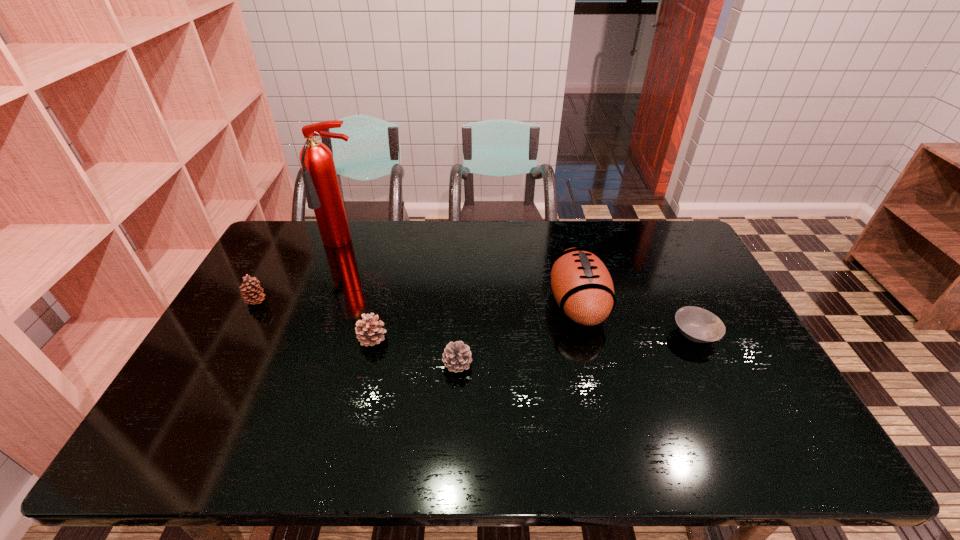
I want to click on the farthest object, so [x=323, y=194].

Find the location of a particular element. The width and height of the screenshot is (960, 540). fire extinguisher is located at coordinates (323, 194).

The width and height of the screenshot is (960, 540). What are the coordinates of `the fifth shortest object` in the screenshot? It's located at (582, 286).

The width and height of the screenshot is (960, 540). I want to click on the fifth object from left to right, so click(582, 286).

Identify the location of the farthest pinecone. The width and height of the screenshot is (960, 540). (252, 293).

Where is `the leftmost object`? the leftmost object is located at coordinates (252, 293).

The width and height of the screenshot is (960, 540). In order to click on the third object from left to right in this screenshot , I will do `click(368, 331)`.

Locate an element on the screen. the second farthest pinecone is located at coordinates (368, 331).

You are a GUI agent. You are given a task and a screenshot of the screen. Output one action in this format:
    pyautogui.click(x=<x>, y=<y>)
    Task: Click on the nearest pinecone
    The width and height of the screenshot is (960, 540).
    Given the screenshot: What is the action you would take?
    pyautogui.click(x=457, y=356)

The height and width of the screenshot is (540, 960). Identify the location of the fourth object from left to right. (457, 356).